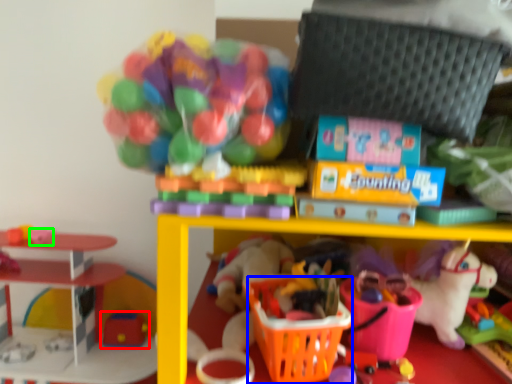
Question: Which object is the farthest from toy (highlighted by a red box)? Choose among these: basket (highlighted by a blue box) or toy (highlighted by a green box).

Choices:
 (A) basket
 (B) toy

Answer: (A)